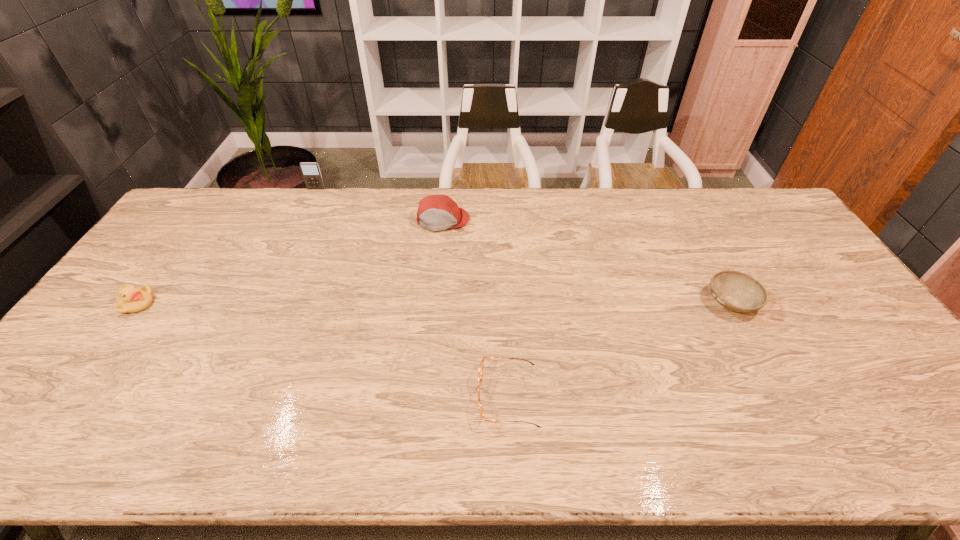
The image size is (960, 540). What are the coordinates of `free area in between the nearest object and the iPod` in the screenshot? It's located at (412, 292).

Locate an element on the screen. free area in between the duckling and the tallest object is located at coordinates (227, 246).

The width and height of the screenshot is (960, 540). I want to click on vacant space that's between the rightmost object and the tallest object, so click(524, 246).

Locate which object ranks third in proximity to the farthest object. Please provide its 2D coordinates. Your answer should be formatted as a tuple, i.e. [(x, y)], where the tuple contains the x and y coordinates of a point satisfying the conditions above.

[(480, 372)]

Choose which object is the third nearest neighbor to the leftmost object. Please provide its 2D coordinates. Your answer should be formatted as a tuple, i.e. [(x, y)], where the tuple contains the x and y coordinates of a point satisfying the conditions above.

[(480, 372)]

I want to click on free point that satisfies the following two spatial constraints: 1. on the front-facing side of the cap; 2. on the front-facing side of the leftmost object, so click(435, 304).

You are a GUI agent. You are given a task and a screenshot of the screen. Output one action in this format:
    pyautogui.click(x=<x>, y=<y>)
    Task: Click on the free spot that satisfies the following two spatial constraints: 1. on the front-facing side of the cap; 2. on the front-facing side of the duckling
    This screenshot has height=540, width=960.
    Given the screenshot: What is the action you would take?
    pyautogui.click(x=435, y=304)

Locate an element on the screen. free spot that satisfies the following two spatial constraints: 1. on the front-facing side of the iPod; 2. on the right side of the bowl is located at coordinates (264, 302).

The image size is (960, 540). I want to click on free region that satisfies the following two spatial constraints: 1. on the front-facing side of the iPod; 2. on the front-facing side of the duckling, so click(263, 304).

Image resolution: width=960 pixels, height=540 pixels. Identify the location of vacant area that satisfies the following two spatial constraints: 1. on the front-facing side of the rightmost object; 2. on the left side of the tallest object. (264, 302).